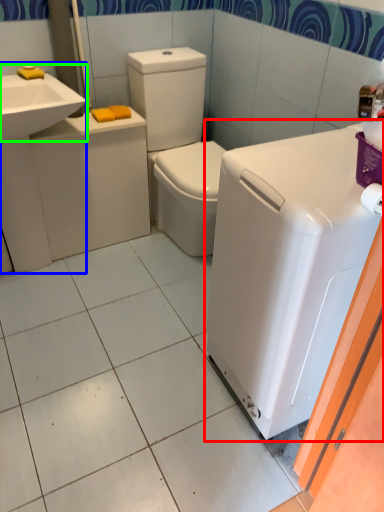
Question: Which object is the closest to the washing machine (highlighted by a red box)? Choose among these: sink (highlighted by a blue box) or sink (highlighted by a green box).

Choices:
 (A) sink
 (B) sink

Answer: (B)